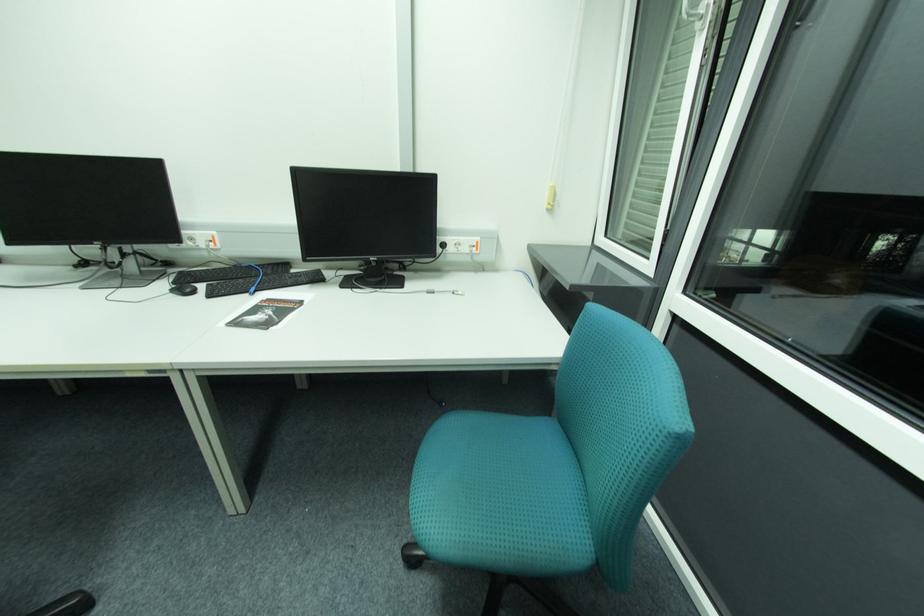
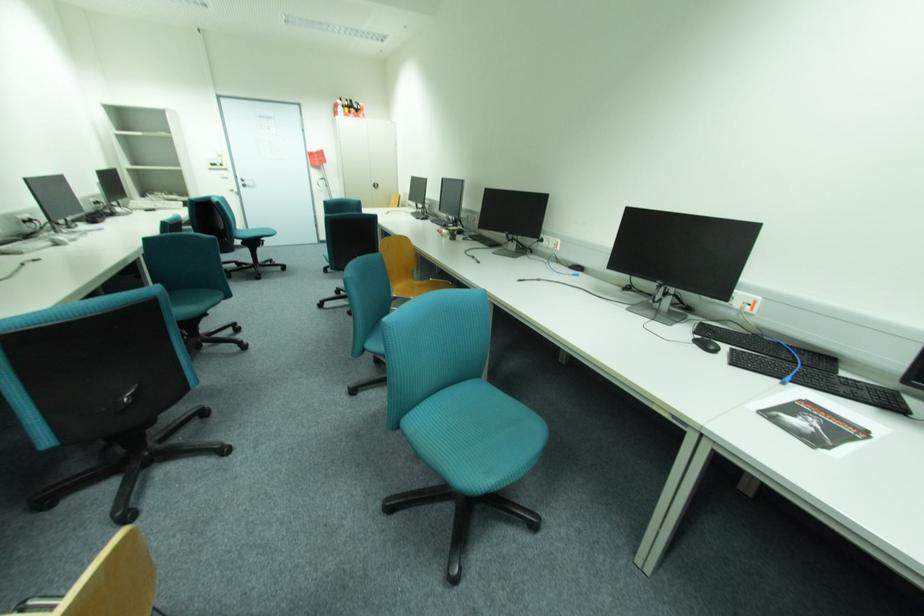
Where in the second image is the point corresponding to the point at 270,301 from the first image?

(807, 400)